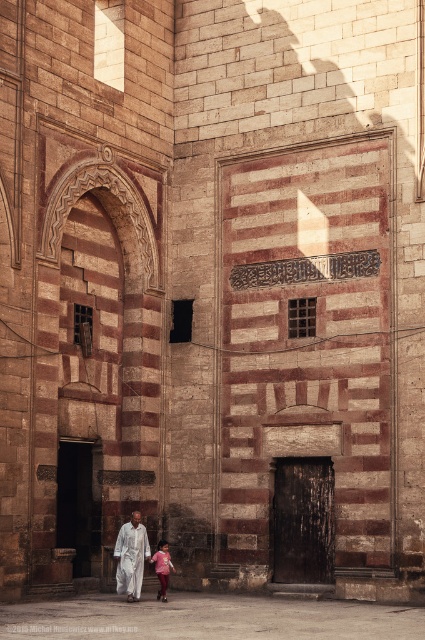
You are standing in front of the historic stone building and notice two points marked on the wall. According to their positions, which point is closer to you, point (x=139, y=589) or point (x=156, y=566)?

Point (x=139, y=589) is in front of point (x=156, y=566), so it is closer to you.

In the scene shown: You are standing in front of the historic stone building and notice two points marked on its facade. The first point is at coordinates point (136, 538) and the second at point (138, 577). Which of these points is closer to you?

Point (136, 538) is further to the viewer than point (138, 577), so the point closer to you is point (138, 577).

You are a photographer trying to capture both the white cotton robe at center and the white matte robe at center in a single frame. Since they are both at the center, which one will appear closer to the camera?

The white cotton robe at center is smaller than the white matte robe at center, so it will appear farther away and thus the white matte robe at center will look closer to the camera.